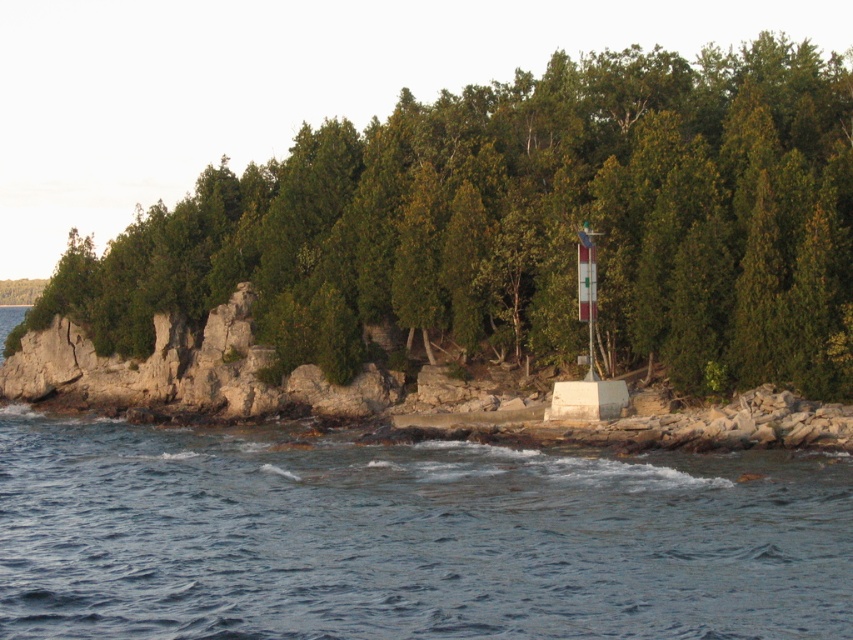
You are a painter setting up your easel to capture the coastal scene. You want to ensure the green matte tree at center and the blue water at lower center are both visible in your painting. Based on their sizes, which object should you position closer to the center of your canvas to maintain balance?

The green matte tree at center has a larger width than the blue water at lower center, so positioning the green matte tree at center closer to the center of the canvas will help maintain balance due to its greater visual weight.

You are standing on the rocky shoreline and want to reach the blue water at lower center without getting wet. Is there a path around the green matte tree at center?

The green matte tree at center is positioned over blue water at lower center, so there is no path around it. You would have to go through the water to reach the blue water at lower center.

You are standing at the origin point of the coordinate system in this coastal scene. You want to place a small wooden bench exactly at the location of the green matte tree at center. What are the coordinates where you should place the bench?

The coordinates for the green matte tree at center are at point (x=526, y=225). Therefore, you should place the bench at coordinates (x=526, y=225).